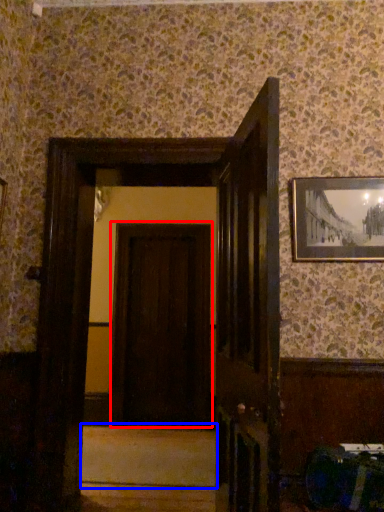
Question: Among these objects, which one is farthest to the camera, door (highlighted by a red box) or stair (highlighted by a blue box)?

Choices:
 (A) door
 (B) stair

Answer: (A)